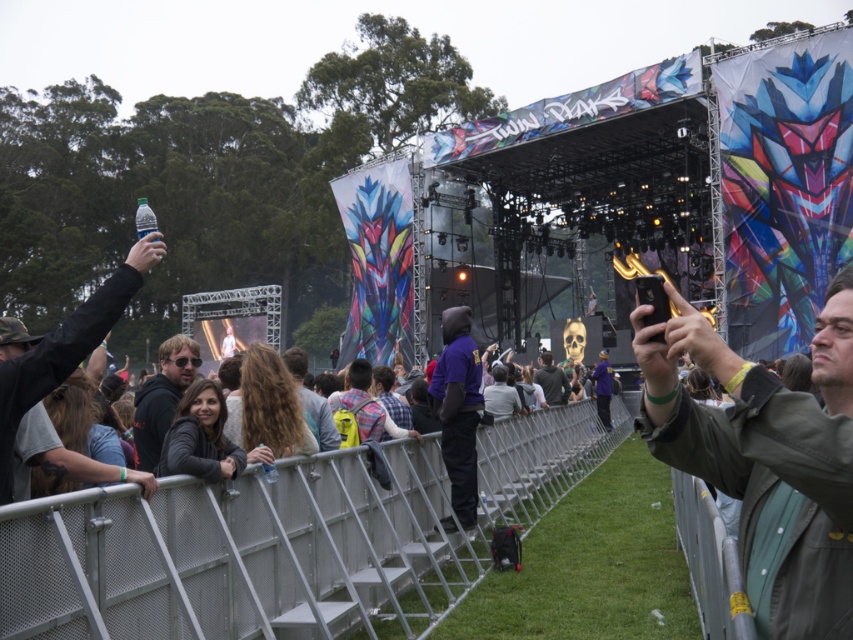
Question: Considering the relative positions of dark gray metal fence at center and dark gray hoodie at center in the image provided, where is dark gray metal fence at center located with respect to dark gray hoodie at center?

Choices:
 (A) right
 (B) left

Answer: (B)

Question: Is green fabric jacket at center to the right of dark gray metal fence at center from the viewer's perspective?

Choices:
 (A) yes
 (B) no

Answer: (A)

Question: Which object appears closest to the camera in this image?

Choices:
 (A) dark gray hoodie at center
 (B) green fabric jacket at center
 (C) matte black jacket at center

Answer: (B)

Question: Which point is closer to the camera?

Choices:
 (A) (788, 403)
 (B) (558, 371)

Answer: (A)

Question: Which point is farther to the camera?

Choices:
 (A) matte black jacket at center
 (B) dark gray hoodie at center
 (C) green fabric jacket at center

Answer: (B)

Question: Is green fabric jacket at center further to the viewer compared to dark gray metal fence at center?

Choices:
 (A) yes
 (B) no

Answer: (B)